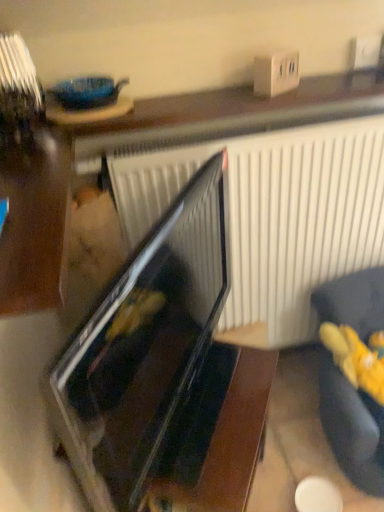
Question: Can you confirm if yellow plush toy at lower right is wider than dark fabric couch at lower right?

Choices:
 (A) no
 (B) yes

Answer: (A)

Question: Considering the relative positions of yellow plush toy at lower right and dark fabric couch at lower right in the image provided, is yellow plush toy at lower right behind dark fabric couch at lower right?

Choices:
 (A) no
 (B) yes

Answer: (B)

Question: From the image's perspective, is yellow plush toy at lower right beneath dark fabric couch at lower right?

Choices:
 (A) yes
 (B) no

Answer: (B)

Question: Would you say yellow plush toy at lower right is outside dark fabric couch at lower right?

Choices:
 (A) no
 (B) yes

Answer: (A)

Question: Does yellow plush toy at lower right contain dark fabric couch at lower right?

Choices:
 (A) no
 (B) yes

Answer: (A)

Question: Considering the relative sizes of yellow plush toy at lower right and dark fabric couch at lower right in the image provided, is yellow plush toy at lower right bigger than dark fabric couch at lower right?

Choices:
 (A) no
 (B) yes

Answer: (A)

Question: From the image's perspective, is black glossy oven at center below dark fabric couch at lower right?

Choices:
 (A) no
 (B) yes

Answer: (A)

Question: Is black glossy oven at center thinner than dark fabric couch at lower right?

Choices:
 (A) no
 (B) yes

Answer: (B)

Question: Is black glossy oven at center outside of dark fabric couch at lower right?

Choices:
 (A) no
 (B) yes

Answer: (B)

Question: Can you confirm if black glossy oven at center is smaller than dark fabric couch at lower right?

Choices:
 (A) no
 (B) yes

Answer: (B)

Question: From a real-world perspective, is black glossy oven at center located beneath dark fabric couch at lower right?

Choices:
 (A) no
 (B) yes

Answer: (A)

Question: Is black glossy oven at center facing towards dark fabric couch at lower right?

Choices:
 (A) no
 (B) yes

Answer: (A)

Question: Is the depth of dark fabric couch at lower right greater than that of black glossy oven at center?

Choices:
 (A) yes
 (B) no

Answer: (A)